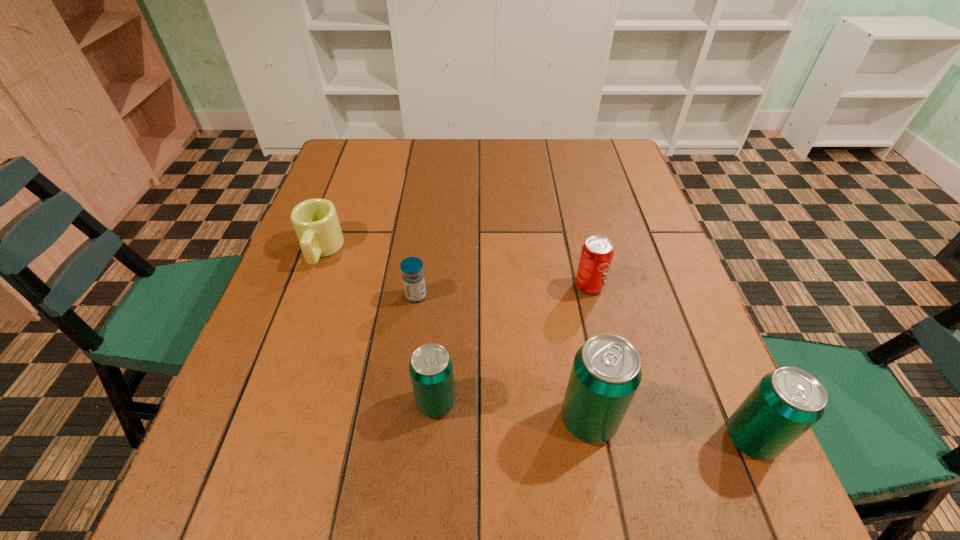
You are a GUI agent. You are given a task and a screenshot of the screen. Output one action in this format:
    pyautogui.click(x=<x>, y=<y>)
    Task: Click on the leftmost beer can
    This screenshot has width=960, height=540.
    Given the screenshot: What is the action you would take?
    pyautogui.click(x=431, y=367)

Locate an element on the screen. This screenshot has height=540, width=960. the shortest beer can is located at coordinates (431, 367).

Image resolution: width=960 pixels, height=540 pixels. Identify the location of the second beer can from left to right. (606, 372).

The image size is (960, 540). Find the location of `the rightmost beer can`. the rightmost beer can is located at coordinates (785, 403).

This screenshot has height=540, width=960. I want to click on the rightmost object, so click(x=785, y=403).

Where is `soda`? Image resolution: width=960 pixels, height=540 pixels. soda is located at coordinates (597, 252).

Find the location of a particular element. This screenshot has height=540, width=960. the leftmost object is located at coordinates (315, 221).

This screenshot has height=540, width=960. Find the location of `mug`. mug is located at coordinates (315, 221).

Where is `medicine`? This screenshot has height=540, width=960. medicine is located at coordinates pyautogui.click(x=412, y=267).

The width and height of the screenshot is (960, 540). I want to click on free space located on the right of the third object from left to right, so click(x=584, y=402).